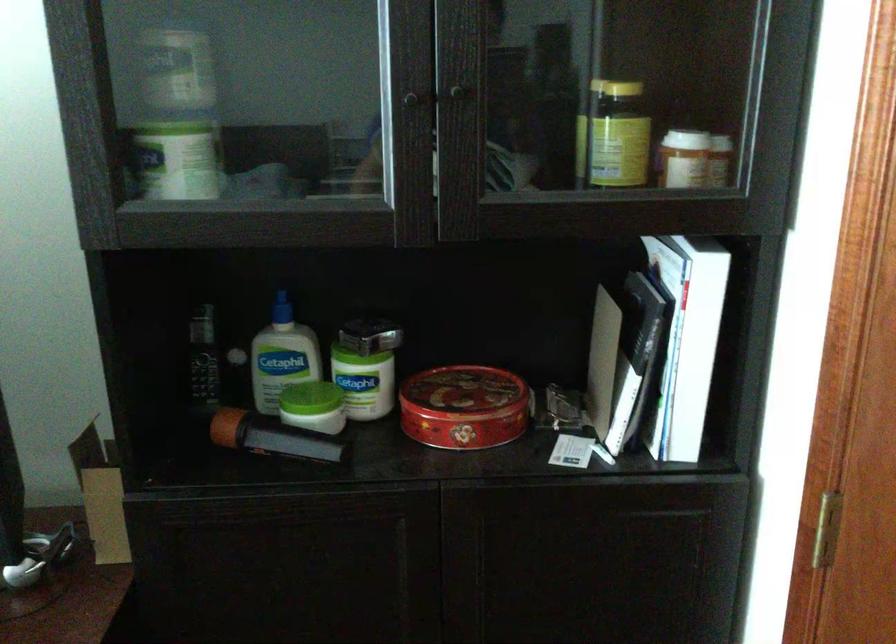
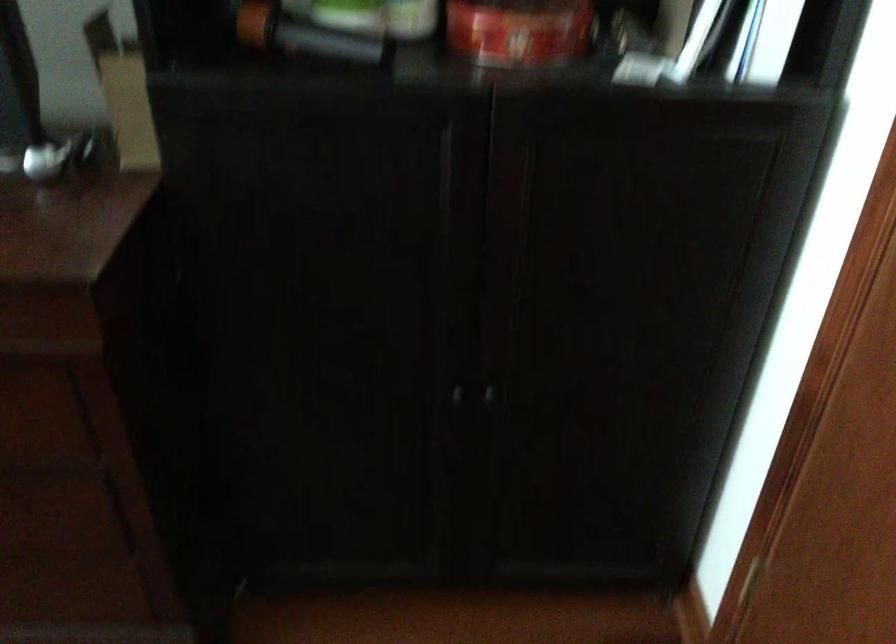
What movement of the cameraman would produce the second image?

The cameraman moved toward left, forward.